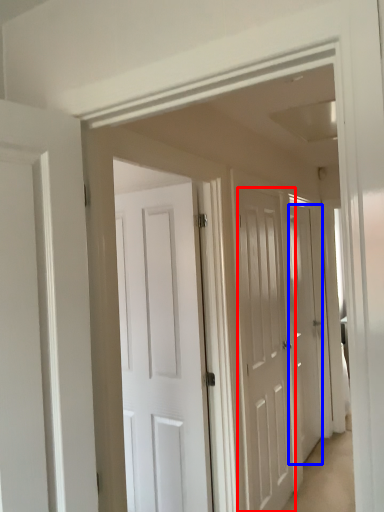
Question: Among these objects, which one is nearest to the camera, door (highlighted by a red box) or door (highlighted by a blue box)?

Choices:
 (A) door
 (B) door

Answer: (A)